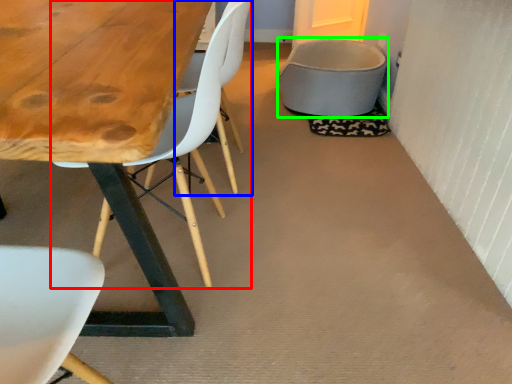
Question: Which object is positioned farthest from chair (highlighted by a red box)? Select from armchair (highlighted by a blue box) and gray (highlighted by a green box).

Choices:
 (A) armchair
 (B) gray

Answer: (B)